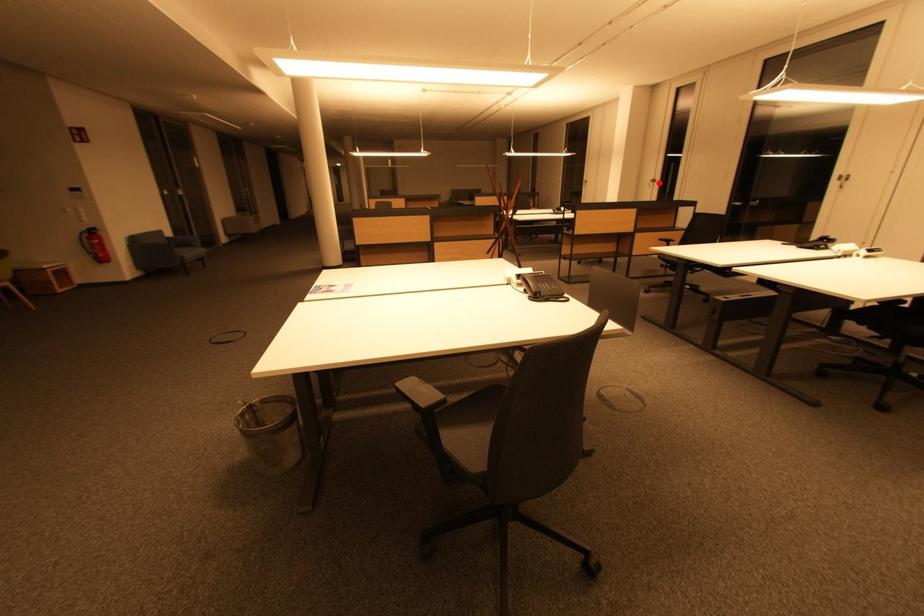
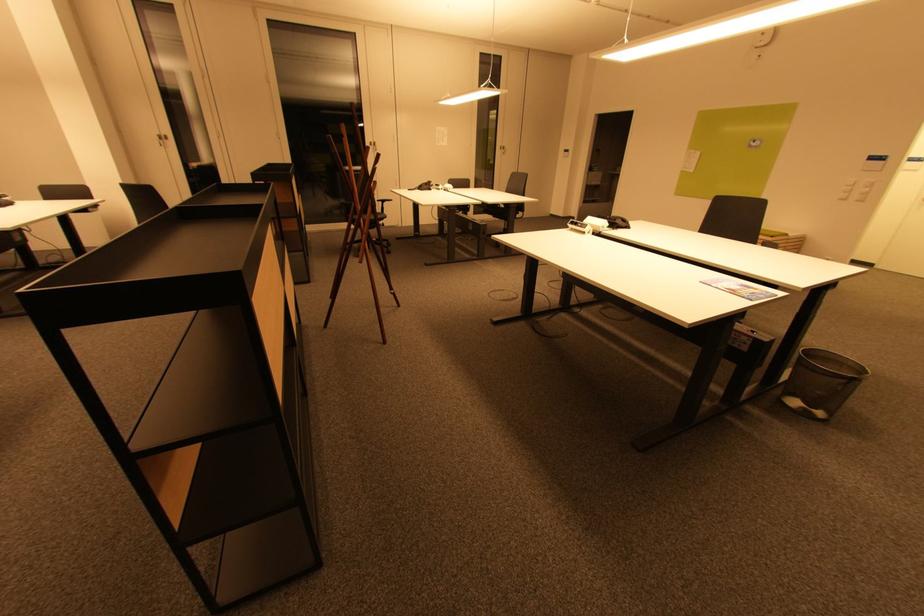
Question: I am providing you with two images of the same scene from different viewpoints. Given a red point in image1, look at the same physical point in image2. Is it:

Choices:
 (A) Closer to the viewpoint
 (B) Farther from the viewpoint

Answer: (B)